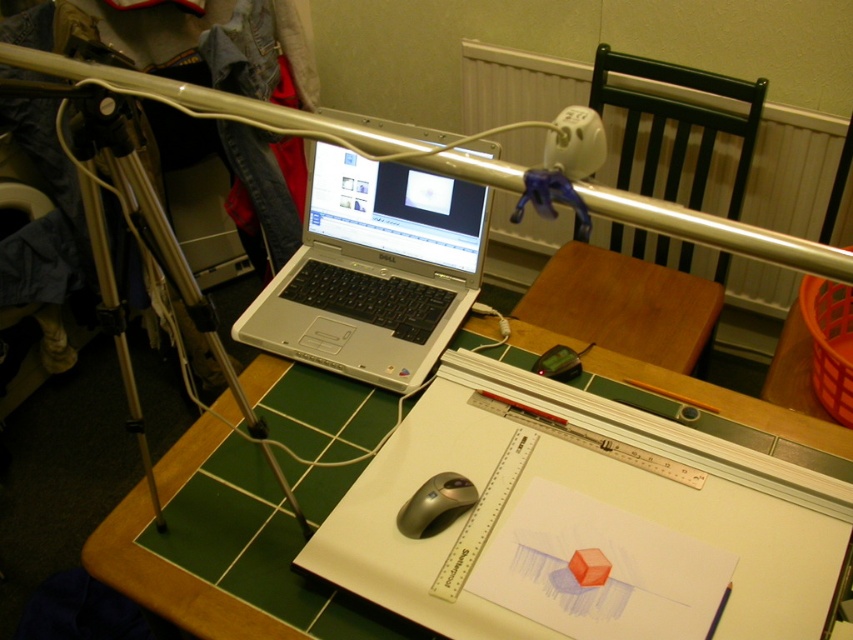
Does silver metallic laptop at center come in front of silver metallic mouse at center?

No, silver metallic laptop at center is behind silver metallic mouse at center.

Is point (314, 246) farther from viewer compared to point (463, 502)?

Yes, point (314, 246) is behind point (463, 502).

Locate an element on the screen. silver metallic laptop at center is located at coordinates (373, 269).

Consider the image. Does silver metallic laptop at center have a greater height compared to green tile table at center?

Yes, silver metallic laptop at center is taller than green tile table at center.

Between point (369, 317) and point (666, 321), which one is positioned in front?

Point (369, 317) is more forward.

The height and width of the screenshot is (640, 853). What do you see at coordinates (373, 269) in the screenshot? I see `silver metallic laptop at center` at bounding box center [373, 269].

Identify the location of silver metallic laptop at center. This screenshot has width=853, height=640. (373, 269).

Which is behind, point (656, 385) or point (123, 74)?

The point (656, 385) is more distant.

From the picture: Does green tile table at center come behind silver metallic rail at upper center?

Yes, it is behind silver metallic rail at upper center.

This screenshot has height=640, width=853. I want to click on green tile table at center, so click(170, 580).